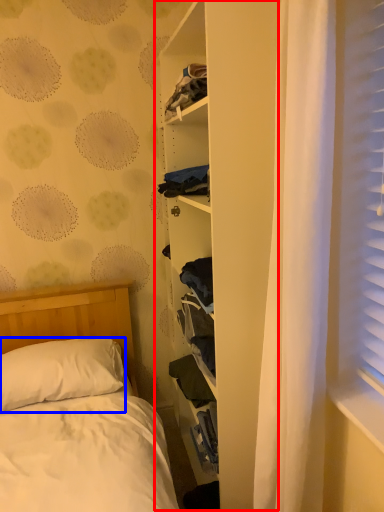
Question: Which object appears closest to the camera in this image, bookshelf (highlighted by a red box) or pillow (highlighted by a blue box)?

Choices:
 (A) bookshelf
 (B) pillow

Answer: (A)